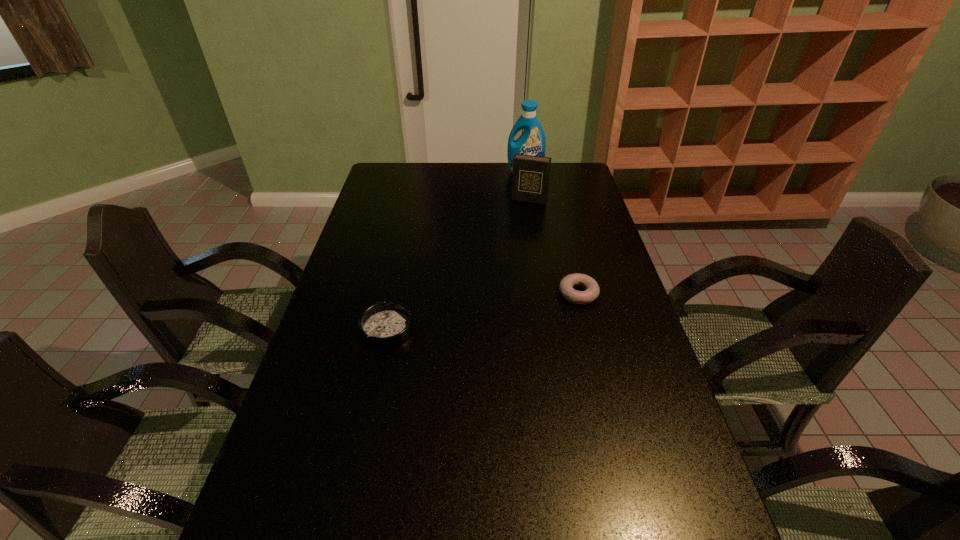
You are a GUI agent. You are given a task and a screenshot of the screen. Output one action in this format:
    pyautogui.click(x=<x>, y=<y>)
    Task: Click on the free area in between the third farthest object and the nearest object
    The image size is (960, 540).
    Given the screenshot: What is the action you would take?
    pyautogui.click(x=483, y=312)

The width and height of the screenshot is (960, 540). Identify the location of free point between the diary and the nearest object. (458, 265).

Identify the location of free space between the leftmost object and the tallest object. (456, 251).

Where is `empty space between the second nearest object and the nearest object`? empty space between the second nearest object and the nearest object is located at coordinates (483, 312).

In order to click on the third closest object to the third nearest object in this screenshot , I will do `click(382, 325)`.

Point out which object is positioned as the third nearest to the leftmost object. Please provide its 2D coordinates. Your answer should be formatted as a tuple, i.e. [(x, y)], where the tuple contains the x and y coordinates of a point satisfying the conditions above.

[(532, 141)]

You are a GUI agent. You are given a task and a screenshot of the screen. Output one action in this format:
    pyautogui.click(x=<x>, y=<y>)
    Task: Click on the free space in the image that satisfies the following two spatial constraints: 1. on the back side of the detergent; 2. on the right side of the leftmost object
    
    Given the screenshot: What is the action you would take?
    pyautogui.click(x=420, y=172)

Identify the location of vacant space that satisfies the following two spatial constraints: 1. on the front side of the second nearest object; 2. on the left side of the second farthest object. (544, 294).

The width and height of the screenshot is (960, 540). Identify the location of free space that satisfies the following two spatial constraints: 1. on the back side of the ashtray; 2. on the right side of the second farthest object. (415, 200).